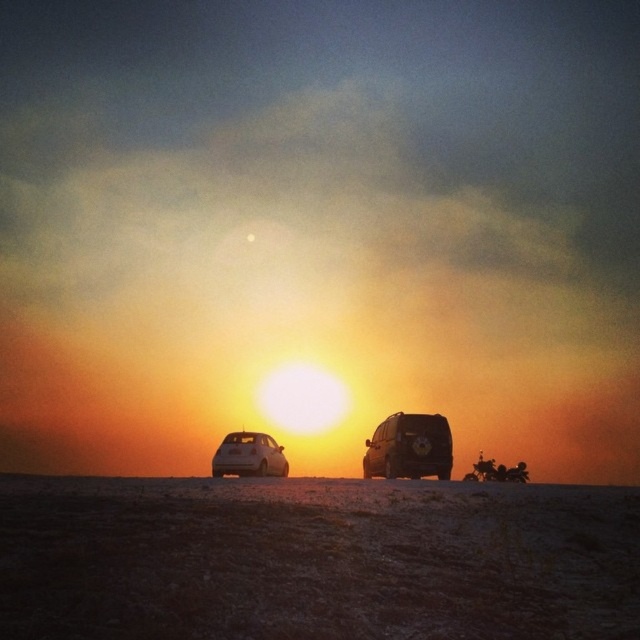
Can you confirm if shiny black suv at center is positioned above white matte hatchback at lower left?

Yes.

Is shiny black suv at center smaller than white matte hatchback at lower left?

Yes.

The width and height of the screenshot is (640, 640). Identify the location of shiny black suv at center. (410, 448).